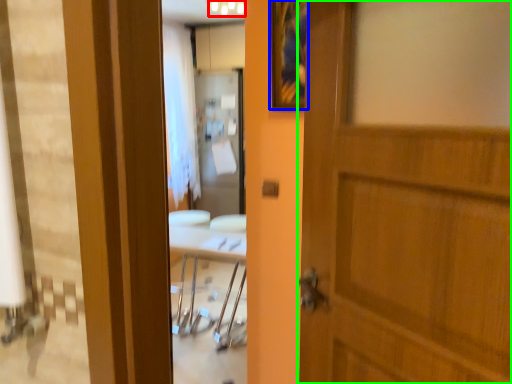
Question: Which is nearer to the light fixture (highlighted by a red box)? picture frame (highlighted by a blue box) or door (highlighted by a green box).

Choices:
 (A) picture frame
 (B) door

Answer: (A)